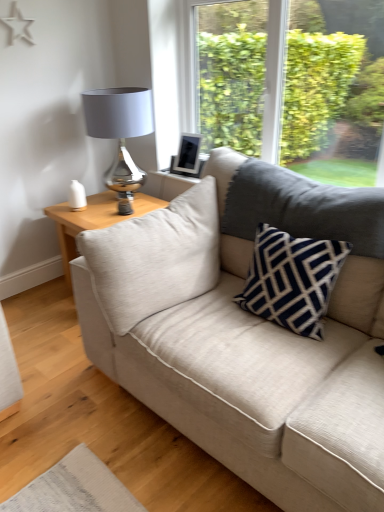
Question: Is matte silver table lamp at upper left located outside navy blue textured pillow at center?

Choices:
 (A) no
 (B) yes

Answer: (B)

Question: Is matte silver table lamp at upper left positioned with its back to navy blue textured pillow at center?

Choices:
 (A) yes
 (B) no

Answer: (B)

Question: Would you consider matte silver table lamp at upper left to be distant from navy blue textured pillow at center?

Choices:
 (A) yes
 (B) no

Answer: (A)

Question: From a real-world perspective, is matte silver table lamp at upper left over navy blue textured pillow at center?

Choices:
 (A) no
 (B) yes

Answer: (B)

Question: Does matte silver table lamp at upper left appear on the left side of navy blue textured pillow at center?

Choices:
 (A) no
 (B) yes

Answer: (B)

Question: Can you confirm if matte silver table lamp at upper left is thinner than navy blue textured pillow at center?

Choices:
 (A) no
 (B) yes

Answer: (A)

Question: From a real-world perspective, is matte silver table lamp at upper left below light wood/texture side table at left?

Choices:
 (A) no
 (B) yes

Answer: (A)

Question: Can you confirm if matte silver table lamp at upper left is bigger than light wood/texture side table at left?

Choices:
 (A) yes
 (B) no

Answer: (B)

Question: Is light wood/texture side table at left a part of matte silver table lamp at upper left?

Choices:
 (A) yes
 (B) no

Answer: (B)

Question: From the image's perspective, is matte silver table lamp at upper left under light wood/texture side table at left?

Choices:
 (A) yes
 (B) no

Answer: (B)

Question: From a real-world perspective, is matte silver table lamp at upper left positioned over light wood/texture side table at left based on gravity?

Choices:
 (A) no
 (B) yes

Answer: (B)

Question: Is matte silver table lamp at upper left turned away from light wood/texture side table at left?

Choices:
 (A) no
 (B) yes

Answer: (A)

Question: Can you confirm if beige fabric couch at center is thinner than light wood/texture side table at left?

Choices:
 (A) yes
 (B) no

Answer: (B)